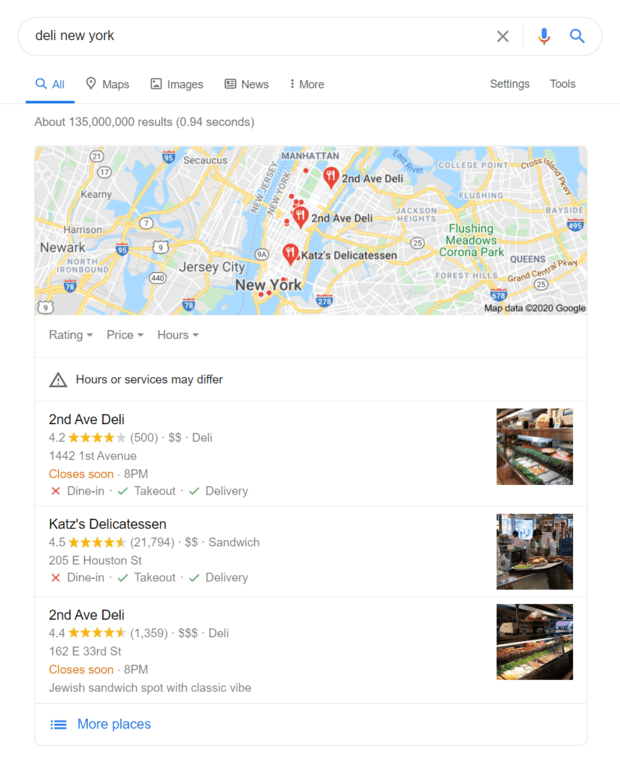
Identify the location of buffet. This screenshot has height=760, width=620. (525, 670).